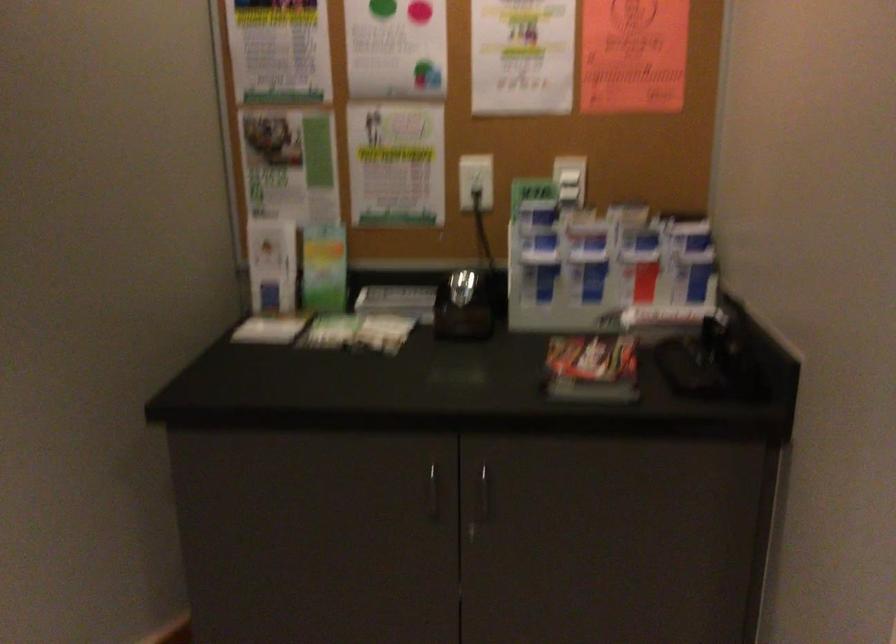
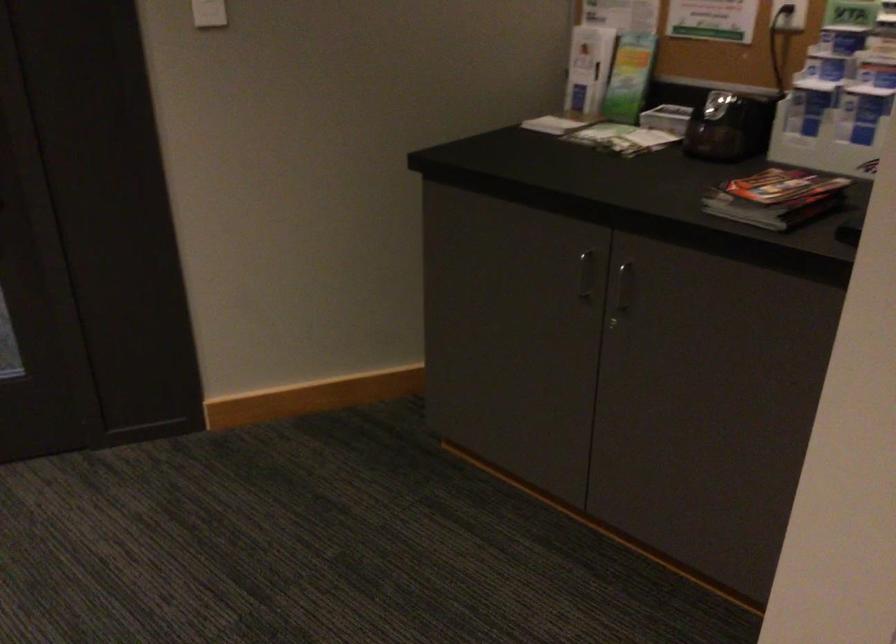
Where in the second image is the point corresponding to point (476, 500) from the first image?

(622, 292)